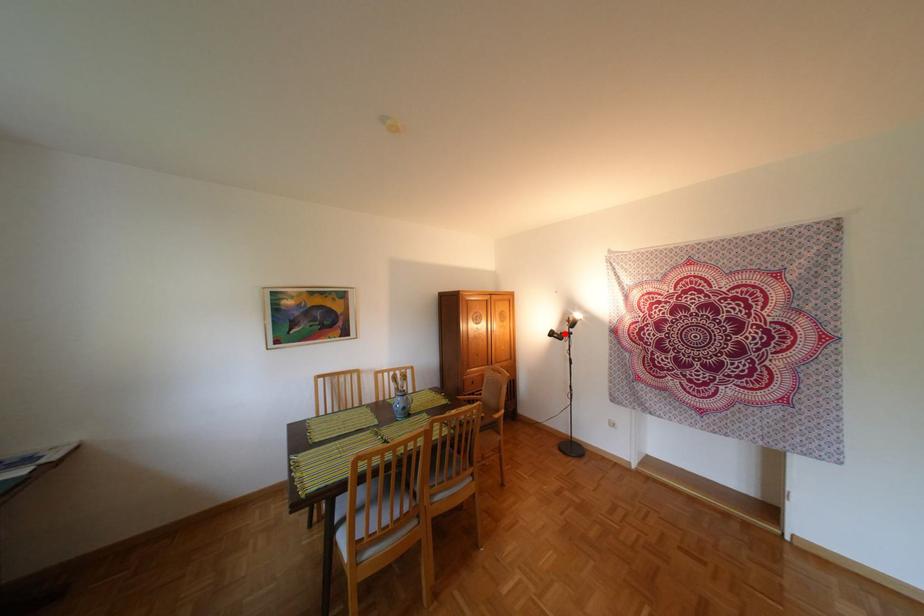
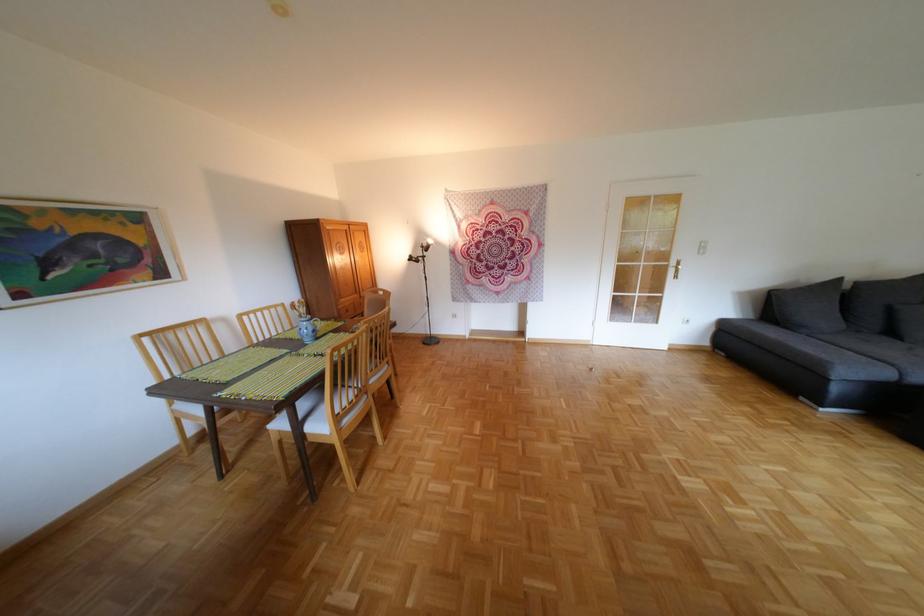
Question: A red point is marked in image1. In image2, is the corresponding 3D point closer to the camera or farther? Reply with the corresponding letter.

Choices:
 (A) The corresponding 3D point is closer.
 (B) The corresponding 3D point is farther.

Answer: (A)